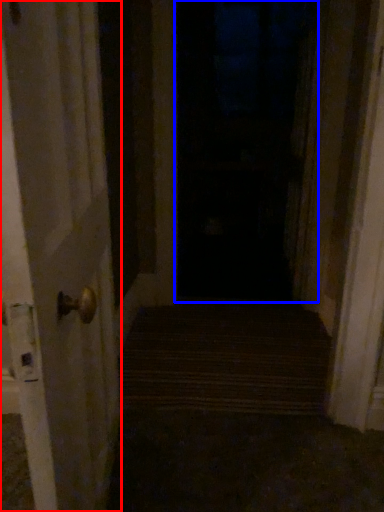
Question: Among these objects, which one is farthest to the camera, door (highlighted by a red box) or window (highlighted by a blue box)?

Choices:
 (A) door
 (B) window

Answer: (B)